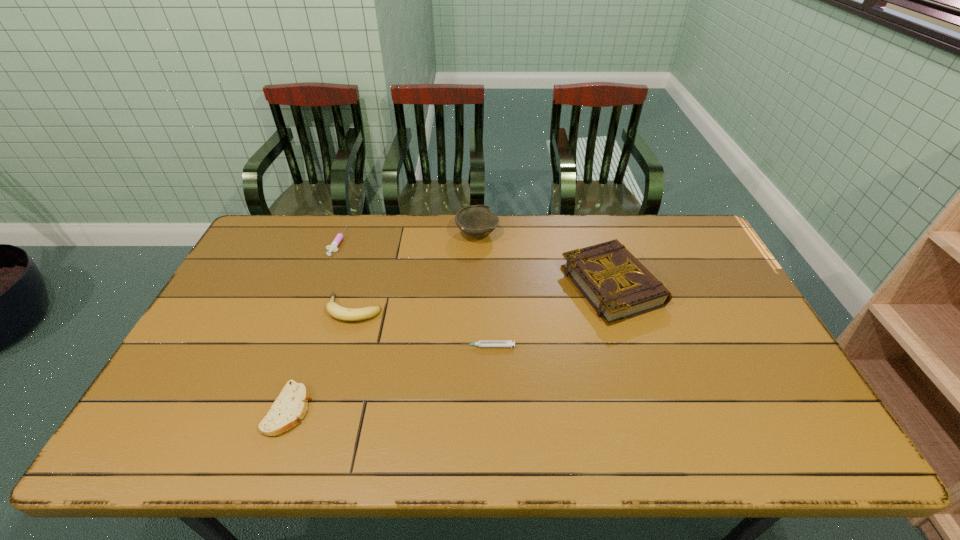
Find the location of `free point between the bowl and the hardback book`. free point between the bowl and the hardback book is located at coordinates (545, 260).

I want to click on vacant space that's between the rightmost object and the third shortest object, so click(474, 264).

I want to click on free spot between the farther syringe and the hardback book, so click(x=474, y=264).

Where is `free point between the pita bread and the third tallest object`? free point between the pita bread and the third tallest object is located at coordinates (322, 359).

Select which object is the third closest to the farther syringe. Please provide its 2D coordinates. Your answer should be formatted as a tuple, i.e. [(x, y)], where the tuple contains the x and y coordinates of a point satisfying the conditions above.

[(290, 406)]

Identify which object is the fifth nearest to the rightmost object. Please provide its 2D coordinates. Your answer should be formatted as a tuple, i.e. [(x, y)], where the tuple contains the x and y coordinates of a point satisfying the conditions above.

[(333, 246)]

Locate an element on the screen. vacant position in the image that satisfies the following two spatial constraints: 1. on the back side of the hardback book; 2. on the left side of the nearest object is located at coordinates (332, 286).

Locate an element on the screen. vacant region that satisfies the following two spatial constraints: 1. on the back side of the bowl; 2. on the left side of the fourth tallest object is located at coordinates (340, 234).